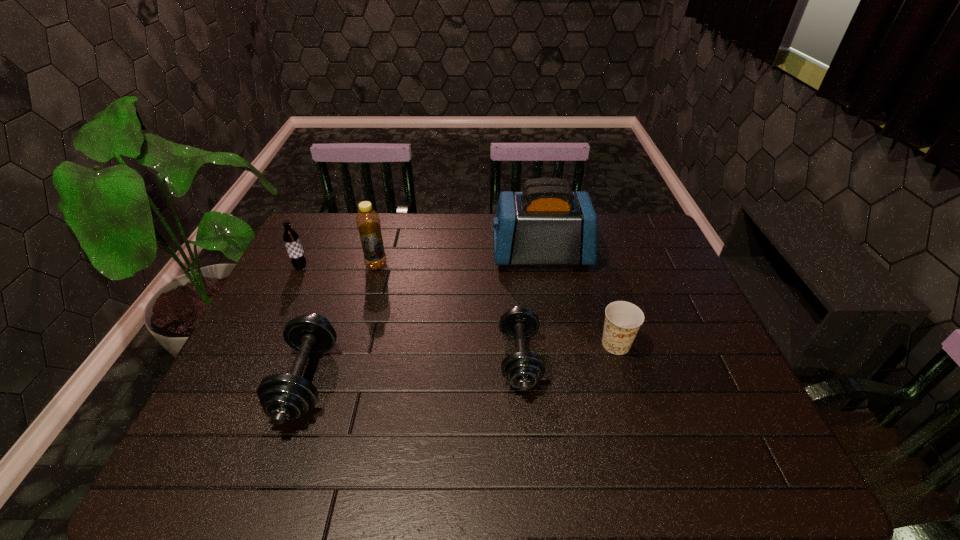
In order to click on the taller dumbbell in this screenshot , I will do `click(284, 397)`.

Find the location of a particular element. the shorter dumbbell is located at coordinates 523,370.

Identify the location of toaster. Image resolution: width=960 pixels, height=540 pixels. (547, 224).

The width and height of the screenshot is (960, 540). I want to click on the fifth shortest object, so click(368, 223).

Identify the location of the leftmost object. The image size is (960, 540). (291, 239).

The height and width of the screenshot is (540, 960). Identify the location of the third tallest object. click(x=291, y=239).

The image size is (960, 540). What are the coordinates of `Dixie cup` in the screenshot? It's located at (623, 319).

Image resolution: width=960 pixels, height=540 pixels. Identify the location of blank space located on the right of the taller dumbbell. (362, 380).

You are a GUI agent. You are given a task and a screenshot of the screen. Output one action in this format:
    pyautogui.click(x=<x>, y=<y>)
    Task: Click on the free region located on the left of the right dumbbell
    This screenshot has width=960, height=540.
    Given the screenshot: What is the action you would take?
    pyautogui.click(x=344, y=359)

Identify the location of vacant position located on the front-facing side of the toaster. (410, 255).